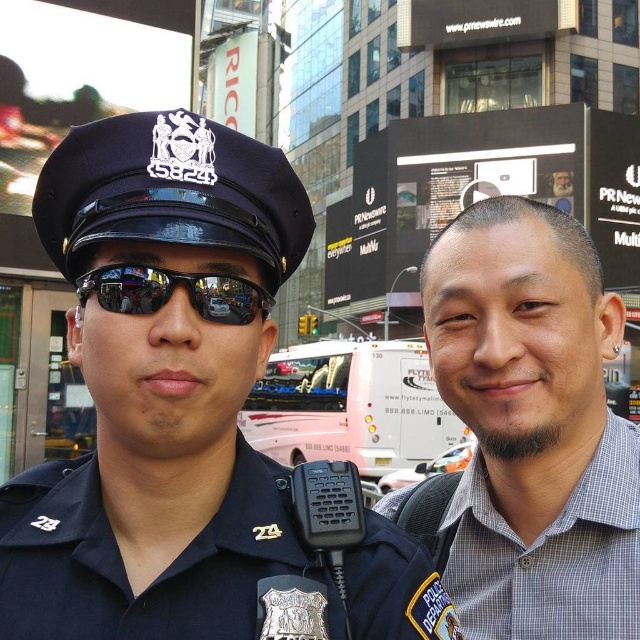
You are a photographer trying to capture both the blue uniform at left and the gray checkered shirt at right in a single frame. Since you want to ensure both are fully visible, which person should you position closer to the camera to avoid cropping?

The blue uniform at left is shorter than the gray checkered shirt at right. To ensure both are fully visible, position the blue uniform at left closer to the camera so its shorter height doesn